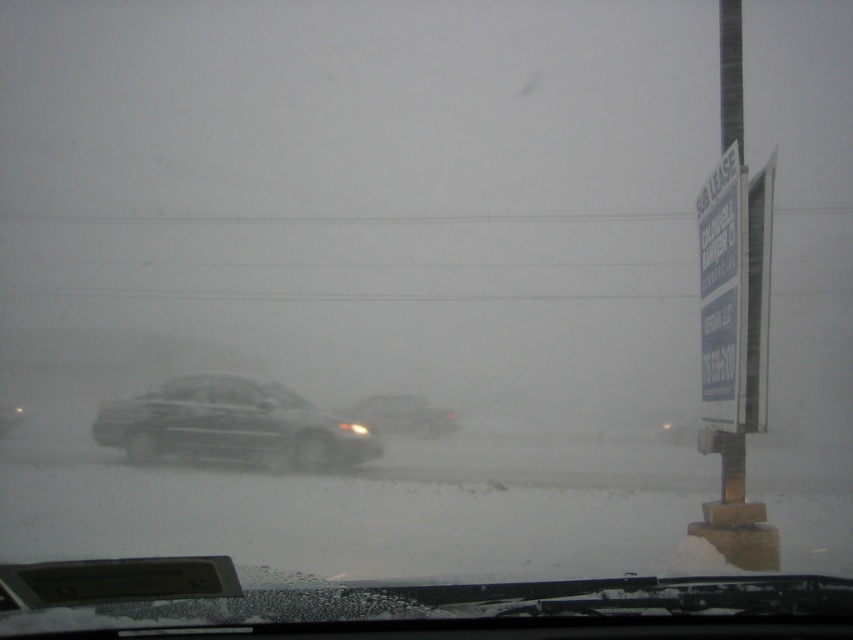
You are a driver navigating through heavy fog and need to locate the white paper sign at right. Based on the image, where would you expect to find it in relation to the dashboard?

The white paper sign at right is positioned at the lower right area of the image, near the dashboard, as its 2D coordinates are at point [722,291] which places it close to the bottom of the frame.

You are inside a car and looking through the windshield. There is a point marked at coordinates (231, 424) in your view. Based on the scene, can you identify what object this point is located on?

The point at coordinates (231, 424) is located on the sleek metallic sedan at center.

You are a passenger in the vehicle and notice the sleek metallic sedan at center and the white paper sign at right through the foggy windshield. Which object appears bigger to you?

The sleek metallic sedan at center appears bigger than the white paper sign at right because it is closer to the vehicle, making it larger in size.